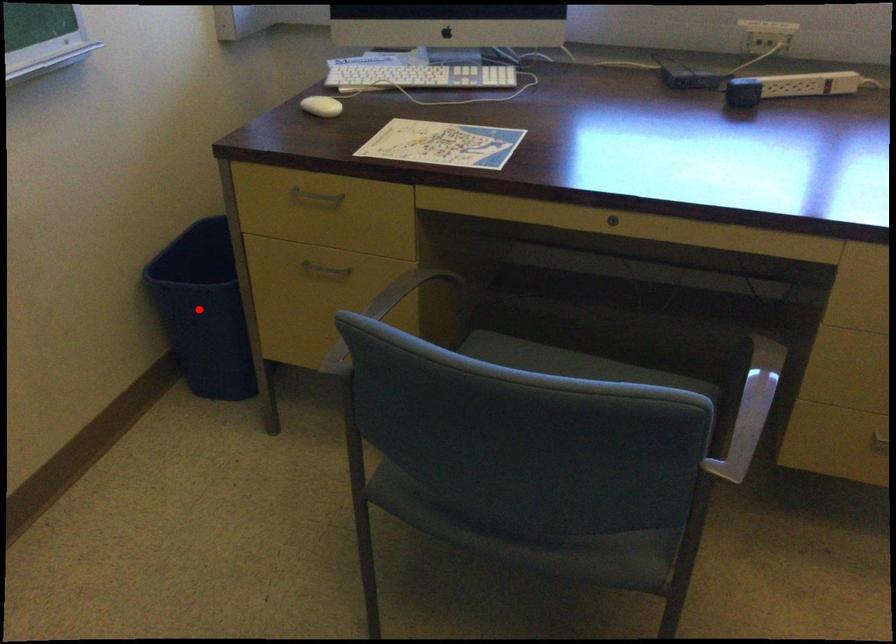
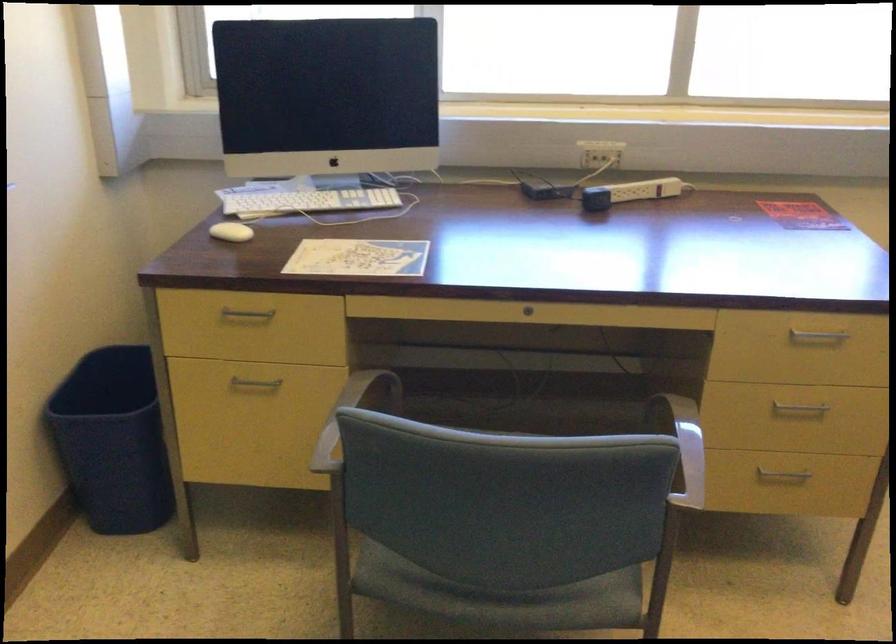
In the second image, find the point that corresponds to the highlighted location in the first image.

(113, 440)